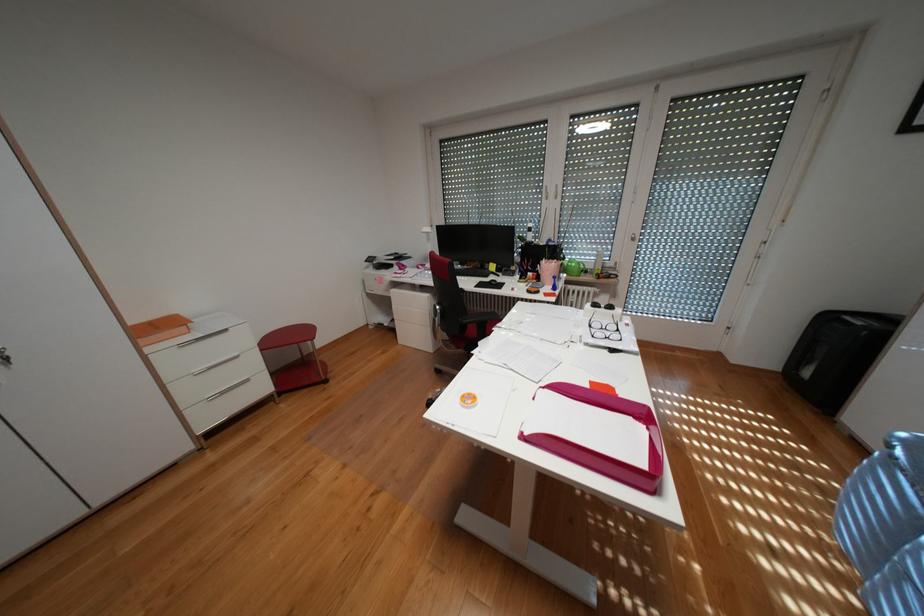
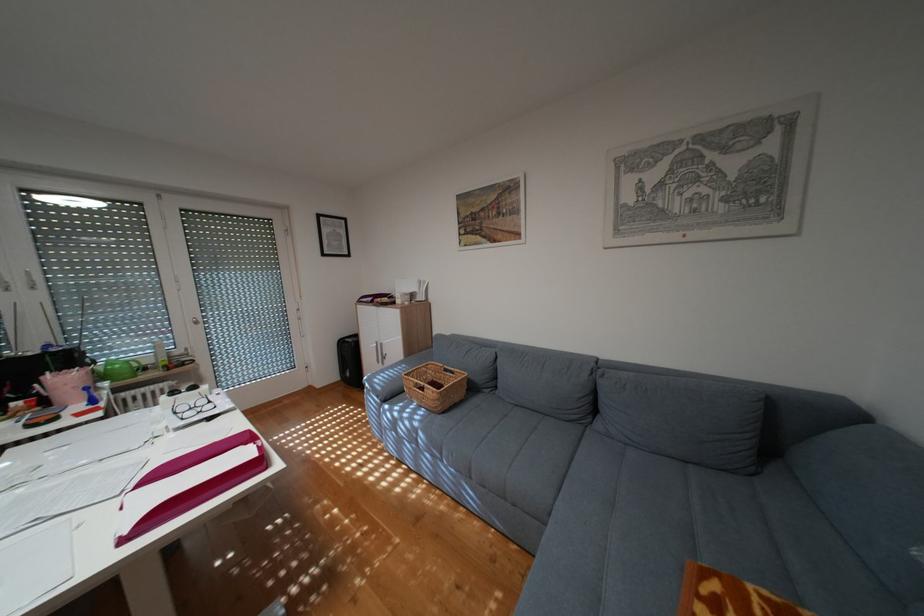
Question: The camera is either moving clockwise (left) or counter-clockwise (right) around the object. The first image is from the beginning of the video and the second image is from the end. Is the camera moving left or right when shooting the video?

Choices:
 (A) Left
 (B) Right

Answer: (A)